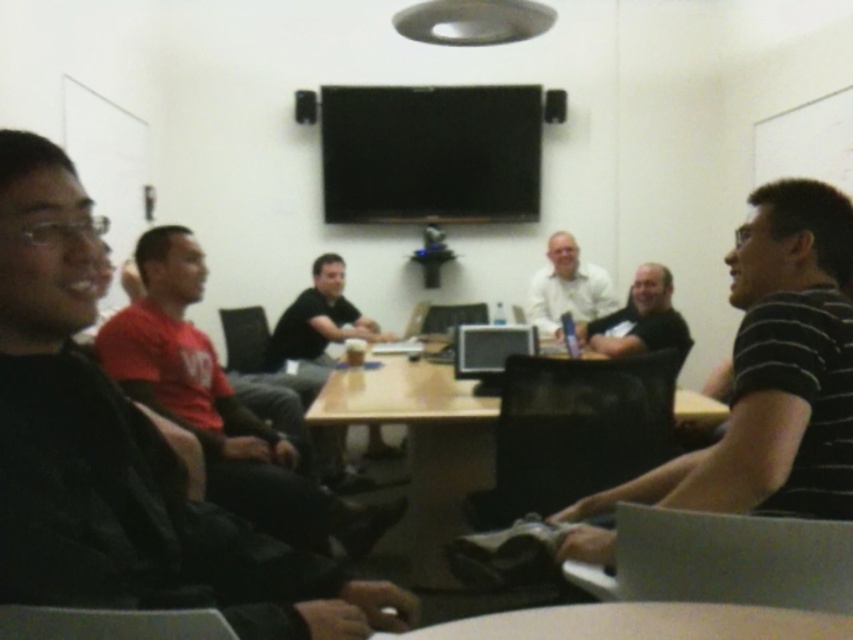
You are standing in the meeting room and want to greet the person wearing the black striped shirt at right. If you can reach out 3 feet, can you shake their hand?

The black striped shirt at right and viewer are 4.21 feet apart from each other, so you cannot shake their hand because the distance is greater than your 3 feet reach.

You are organizing a team meeting and need to determine seating arrangements based on the image provided. If you want to seat the next person between the red matte shirt at left and the black matte shirt at center, where should you place them?

The next person should be seated between the red matte shirt at left and the black matte shirt at center. Since the red matte shirt at left might be wider than the black matte shirt at center, there might be sufficient space between them for the new person to sit.